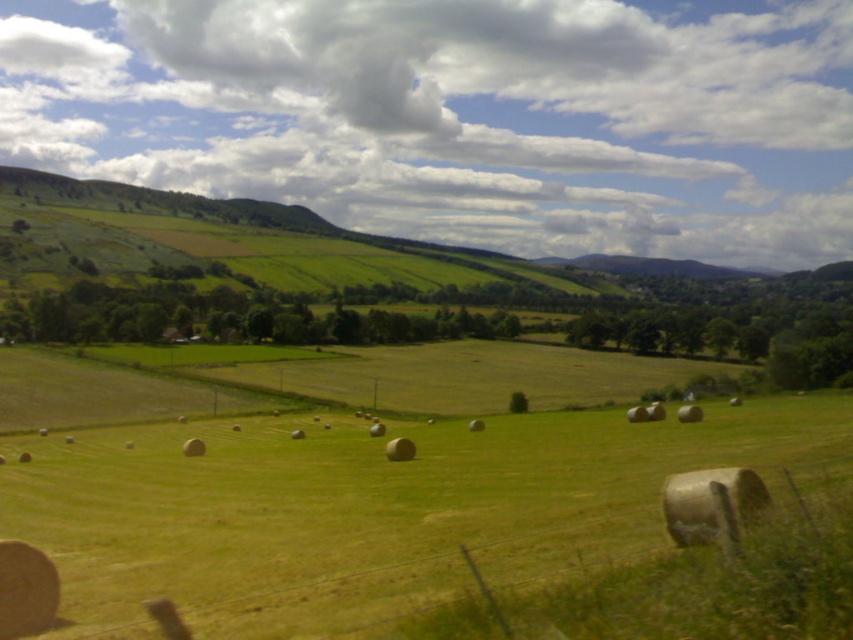
From the picture: You are standing at point A located at coordinates [372,509] in the image. Looking around, what do you see immediately around you?

At point A located at coordinates [372,509], you are in the green grassy field at center.

In the scene shown: You are standing in the rural landscape and want to walk to the green grassy hillside at upper left. Which direction should you move relative to the green grassy field at center?

To reach the green grassy hillside at upper left, you should move away from the green grassy field at center since the hillside is further away from the viewer compared to the field.